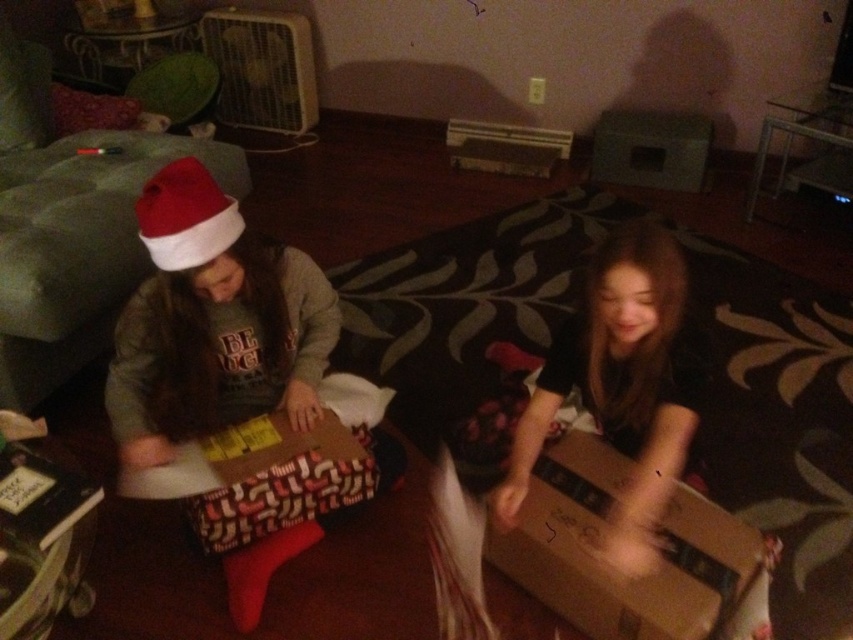
Question: Based on their relative distances, which object is nearer to the matte gray sweater at center?

Choices:
 (A) red matte santa hat at upper left
 (B) smooth cardboard box at center

Answer: (A)

Question: Which point is farther to the camera?

Choices:
 (A) (223, 243)
 (B) (218, 220)
 (C) (584, 324)

Answer: (C)

Question: Can you confirm if matte gray sweater at center is positioned below brown cardboard box at lower right?

Choices:
 (A) yes
 (B) no

Answer: (B)

Question: Among these objects, which one is farthest from the camera?

Choices:
 (A) red matte santa hat at upper left
 (B) brown cardboard box at lower right
 (C) matte gray sweater at center
 (D) smooth cardboard box at center

Answer: (C)

Question: Does smooth cardboard box at center come in front of red matte santa hat at upper left?

Choices:
 (A) yes
 (B) no

Answer: (A)

Question: Does matte gray sweater at center appear on the left side of brown cardboard box at lower right?

Choices:
 (A) no
 (B) yes

Answer: (B)